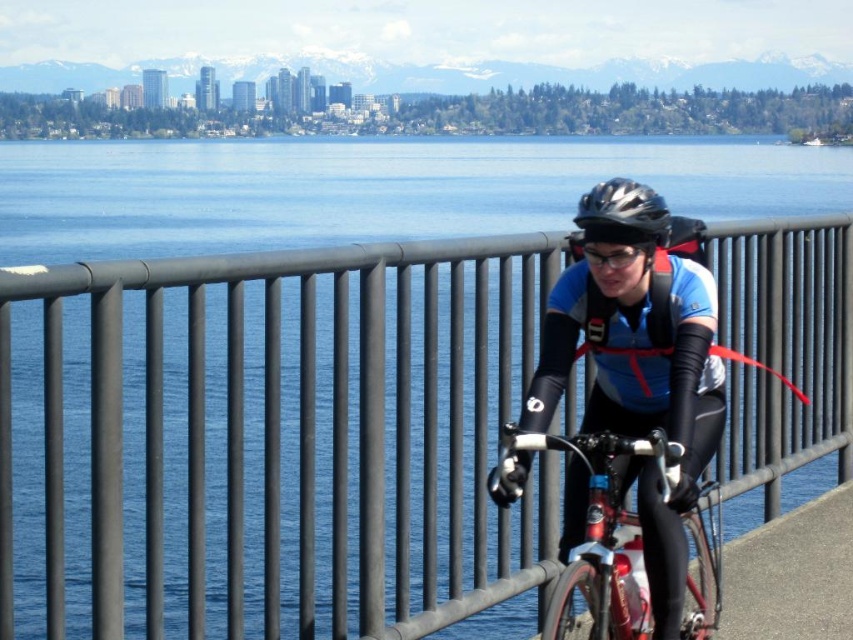
In the scene shown: You are a delivery person who needs to cross the path to deliver a package to the shiny metallic bicycle at center. The black metal fence at center is blocking your way. Can you walk around the fence to reach the bicycle? Please explain your reasoning based on the distance between them.

The black metal fence at center is 22.97 feet away from the shiny metallic bicycle at center. Since the fence is blocking the direct path, you can walk around it as there is sufficient space between the fence and the bicycle to maneuver around the obstacle.

You are a drone operator trying to capture a photo of the cyclist and the city skyline. You have two markers labeled point A and point B placed at coordinates point A at (585, 262) and point B at (590, 248). Which marker is positioned closer to the cyclist?

Point B at (590, 248) is closer to the cyclist because point A at (585, 262) is behind it, meaning point B is in front and closer to the cyclist.

You are a cyclist approaching the black metal fence at center and the shiny metallic bicycle at center. Which object is closer to you as you ride forward?

The black metal fence at center is closer to you because it is positioned in front of the shiny metallic bicycle at center.